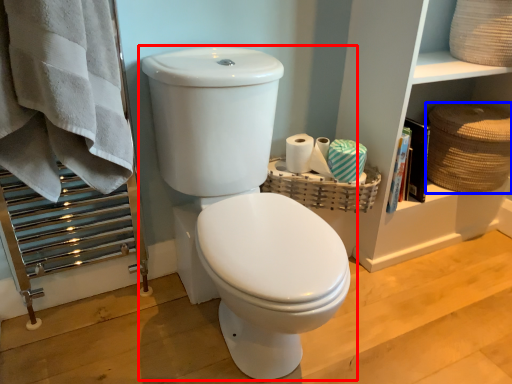
Question: Which point is closer to the camera, toilet (highlighted by a red box) or basket (highlighted by a blue box)?

Choices:
 (A) toilet
 (B) basket

Answer: (A)